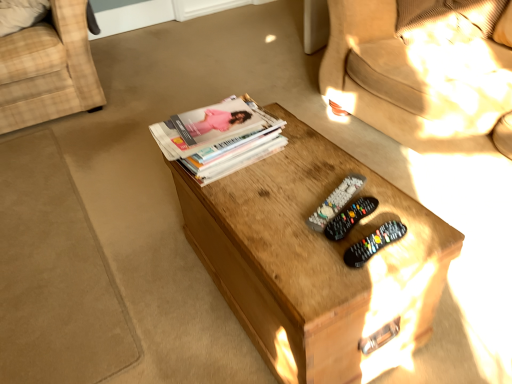
Locate an element on the screen. Image resolution: width=512 pixels, height=384 pixels. vacant space situated above wooden coffee table at center (from a real-world perspective) is located at coordinates pos(302,190).